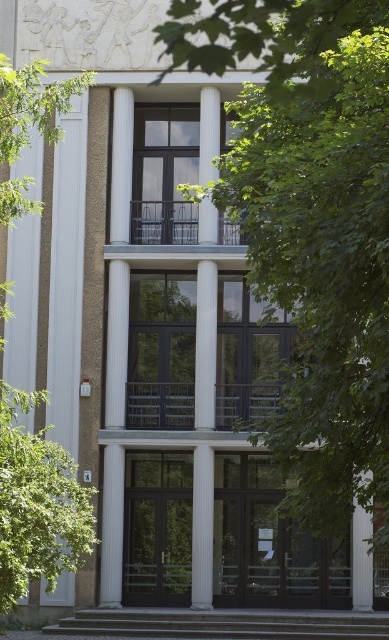
Does green leafy tree at center have a lesser width compared to white glossy column at center?

No.

Is point (313, 531) closer to viewer compared to point (199, 598)?

Yes, it is in front of point (199, 598).

Where is `green leafy tree at center`? green leafy tree at center is located at coordinates (310, 227).

Between green leafy tree at left and white glossy column at center, which one appears on the left side from the viewer's perspective?

Positioned to the left is green leafy tree at left.

Can you confirm if green leafy tree at left is positioned above white glossy column at center?

Actually, green leafy tree at left is below white glossy column at center.

Who is more forward, (47, 472) or (196, 497)?

Point (47, 472)

Identify the location of green leafy tree at left. This screenshot has height=640, width=389. (36, 502).

Does point (227, 156) come behind point (26, 520)?

That is False.

Is green leafy tree at center further to camera compared to green leafy tree at left?

That is False.

Is point (285, 26) closer to camera compared to point (52, 472)?

Yes, it is.

Locate an element on the screen. green leafy tree at center is located at coordinates (310, 227).